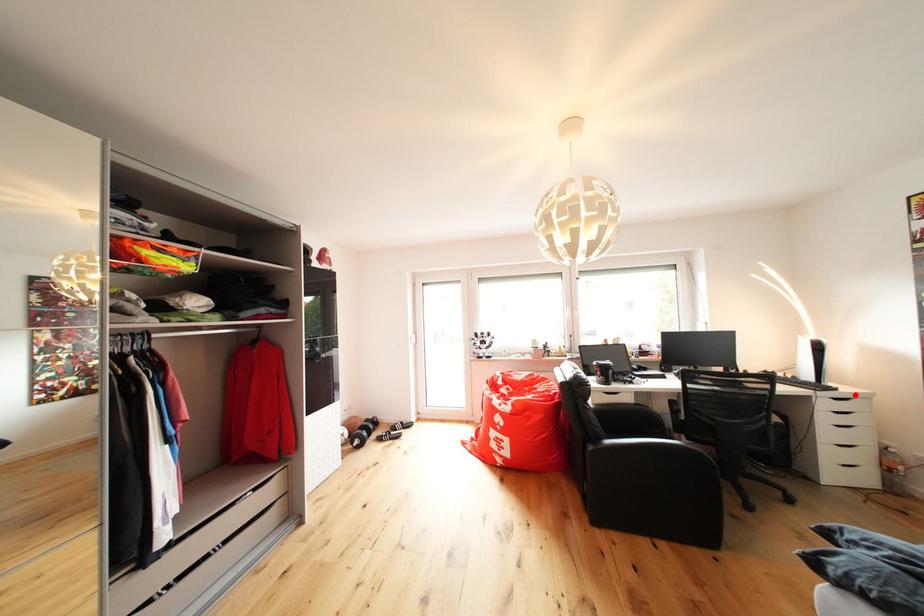
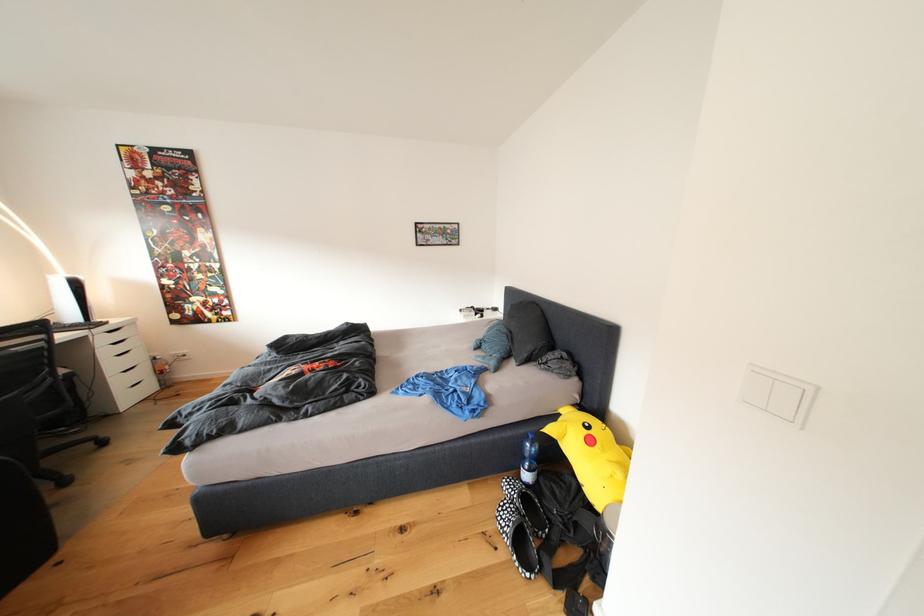
Question: I am providing you with two images of the same scene from different viewpoints. A red point is shown in image1. For the corresponding object point in image2, is it positioned nearer or farther from the camera?

Choices:
 (A) Nearer
 (B) Farther

Answer: (B)